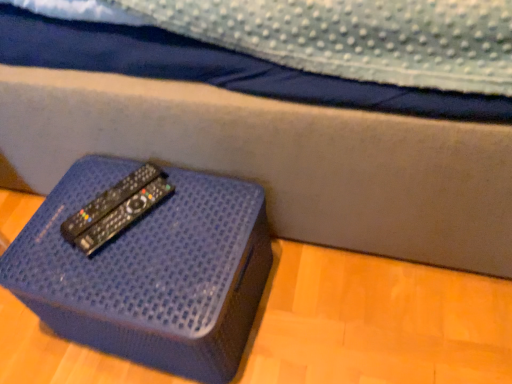
Find the location of a particular element. The image size is (512, 384). free space to the back side of black plastic remote at center is located at coordinates (109, 169).